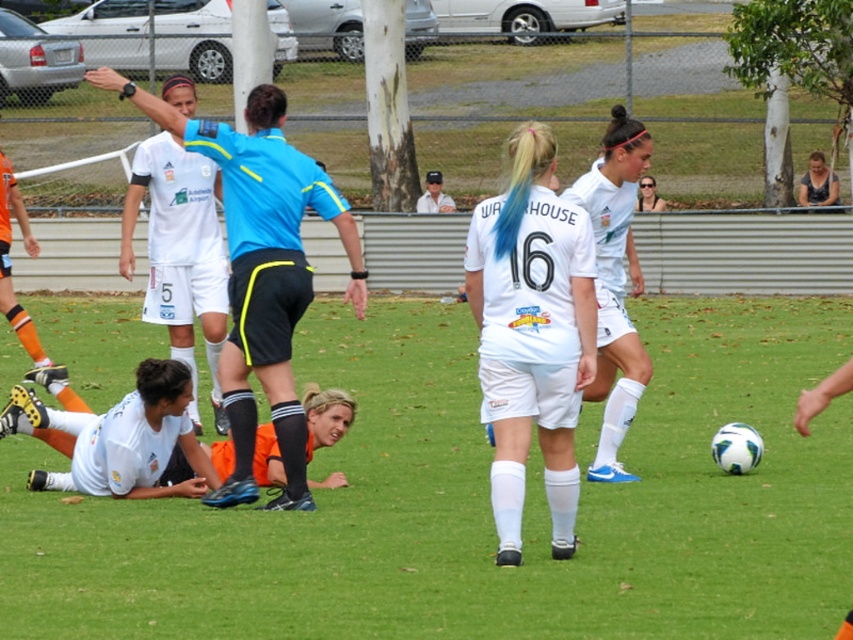
You are a soccer player in the game. You want to pass the ball to your teammate who is standing at point 0.8, 0.5. Is the white matte soccer ball at center within a 0.05 unit radius of that point?

The white matte soccer ball at center is located at point (480, 502). The distance between this point and the teammate at (426, 512) can be calculated using the distance formula. The difference in the x coordinates is 0.8 minus 0.786 equals 0.014. The difference in the y coordinates is 0.564 minus 0.5 equals 0.064. Squaring both differences gives 0.000196 and 0.004096. Adding them together gives 0.004292. Taking the square root gives approximately 0.0655. Since 0.0655 is greater than 0.05, the ball is just